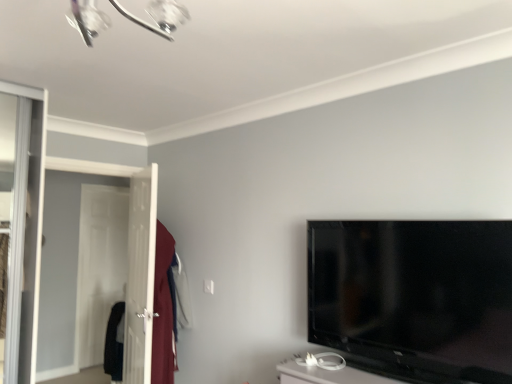
Locate an element on the screen. black glossy tv at right is located at coordinates (414, 297).

This screenshot has height=384, width=512. What do you see at coordinates (414, 297) in the screenshot?
I see `black glossy tv at right` at bounding box center [414, 297].

What is the approximate width of white glossy screen door at left?

The width of white glossy screen door at left is 6.09 inches.

The image size is (512, 384). What do you see at coordinates (140, 276) in the screenshot? I see `white glossy screen door at left` at bounding box center [140, 276].

Find the location of a particular element. white glossy screen door at left is located at coordinates (140, 276).

Where is `black glossy tv at right`? Image resolution: width=512 pixels, height=384 pixels. black glossy tv at right is located at coordinates (414, 297).

Between white glossy screen door at left and black glossy tv at right, which one appears on the right side from the viewer's perspective?

Positioned to the right is black glossy tv at right.

Relative to black glossy tv at right, is white glossy screen door at left in front or behind?

Result: In the image, white glossy screen door at left appears behind black glossy tv at right.

Which point is more forward, [148,351] or [458,243]?

The point [458,243] is closer to the camera.

From the image's perspective, is white glossy screen door at left located above or below black glossy tv at right?

white glossy screen door at left is below black glossy tv at right.

From a real-world perspective, which is physically below, white glossy screen door at left or black glossy tv at right?

In real-world perspective, white glossy screen door at left is lower.

Which of these two, white glossy screen door at left or black glossy tv at right, is thinner?

Thinner between the two is black glossy tv at right.

Does white glossy screen door at left have a lesser height compared to black glossy tv at right?

In fact, white glossy screen door at left may be taller than black glossy tv at right.

Considering the sizes of objects white glossy screen door at left and black glossy tv at right in the image provided, who is smaller, white glossy screen door at left or black glossy tv at right?

black glossy tv at right.

Is white glossy screen door at left not inside black glossy tv at right?

That's correct, white glossy screen door at left is outside of black glossy tv at right.

Is white glossy screen door at left with black glossy tv at right?

white glossy screen door at left is not next to black glossy tv at right, and they're not touching.

Is white glossy screen door at left oriented away from black glossy tv at right?

No, white glossy screen door at left is not facing the opposite direction of black glossy tv at right.

How different are the orientations of white glossy screen door at left and black glossy tv at right in degrees?

There is a 21.4-degree angle between the facing directions of white glossy screen door at left and black glossy tv at right.

Find the location of `screen door on the left of the black glossy tv at right`. screen door on the left of the black glossy tv at right is located at coordinates (140, 276).

Consider the image. Considering the positions of objects black glossy tv at right and white glossy screen door at left in the image provided, who is more to the right, black glossy tv at right or white glossy screen door at left?

black glossy tv at right.

Between black glossy tv at right and white glossy screen door at left, which one is positioned behind?

white glossy screen door at left is more distant.

Between point (326, 293) and point (131, 333), which one is positioned in front?

The point (326, 293) is closer to the camera.

Based on the photo, from the image's perspective, which one is positioned higher, black glossy tv at right or white glossy screen door at left?

black glossy tv at right, from the image's perspective.

In the scene shown: From a real-world perspective, is black glossy tv at right physically located above or below white glossy screen door at left?

black glossy tv at right is above white glossy screen door at left.

Considering the relative sizes of black glossy tv at right and white glossy screen door at left in the image provided, is black glossy tv at right wider than white glossy screen door at left?

In fact, black glossy tv at right might be narrower than white glossy screen door at left.

Considering the sizes of objects black glossy tv at right and white glossy screen door at left in the image provided, who is taller, black glossy tv at right or white glossy screen door at left?

Standing taller between the two is white glossy screen door at left.

Considering the relative sizes of black glossy tv at right and white glossy screen door at left in the image provided, is black glossy tv at right bigger than white glossy screen door at left?

Actually, black glossy tv at right might be smaller than white glossy screen door at left.

Is white glossy screen door at left located within black glossy tv at right?

That's incorrect, white glossy screen door at left is not inside black glossy tv at right.

Are black glossy tv at right and white glossy screen door at left beside each other?

No.

Is black glossy tv at right facing towards white glossy screen door at left?

No.

Measure the distance between black glossy tv at right and white glossy screen door at left.

A distance of 1.57 meters exists between black glossy tv at right and white glossy screen door at left.

Find the location of a particular element. screen door on the left of black glossy tv at right is located at coordinates (140, 276).

You are a GUI agent. You are given a task and a screenshot of the screen. Output one action in this format:
    pyautogui.click(x=<x>, y=<y>)
    Task: Click on the television located above the white glossy screen door at left (from a real-world perspective)
    This screenshot has width=512, height=384.
    Given the screenshot: What is the action you would take?
    pyautogui.click(x=414, y=297)

This screenshot has width=512, height=384. What are the coordinates of `screen door below the black glossy tv at right (from the image's perspective)` in the screenshot? It's located at (140, 276).